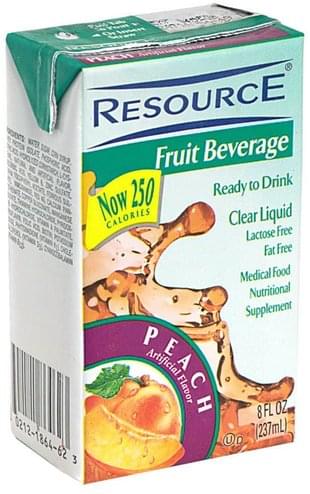
Image resolution: width=310 pixels, height=494 pixels. Identify the location of cup. click(139, 338).